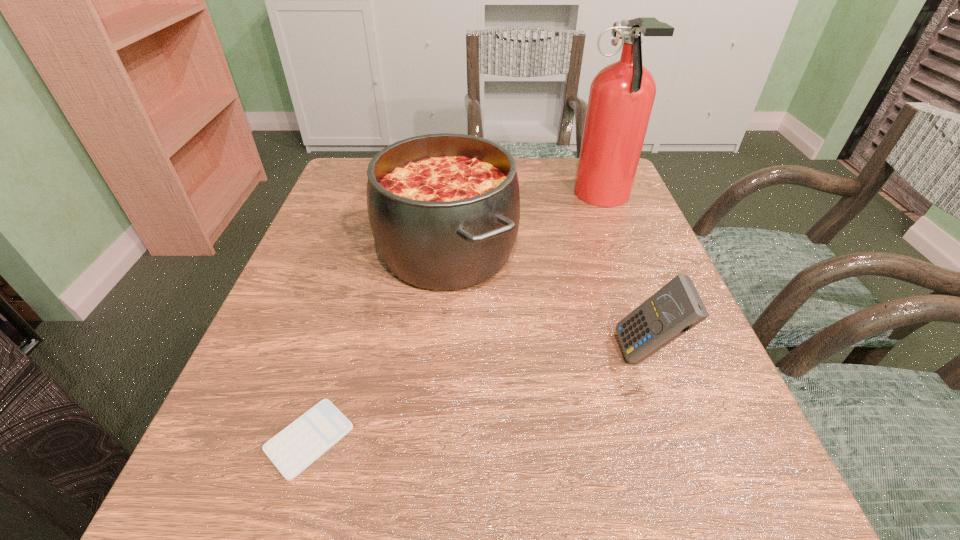
Identify which object is the second closest to the tallest object. Please provide its 2D coordinates. Your answer should be formatted as a tuple, i.e. [(x, y)], where the tuple contains the x and y coordinates of a point satisfying the conditions above.

[(676, 308)]

Locate an element on the screen. The width and height of the screenshot is (960, 540). vacant space that satisfies the following two spatial constraints: 1. on the back side of the tallest object; 2. on the left side of the left calculator is located at coordinates (383, 198).

This screenshot has width=960, height=540. I want to click on free region that satisfies the following two spatial constraints: 1. on the back side of the fire extinguisher; 2. on the right side of the casserole, so click(452, 198).

At what (x,y) coordinates should I click in order to perform the action: click on free point that satisfies the following two spatial constraints: 1. on the back side of the nearer calculator; 2. on the left side of the fire extinguisher. Please return your answer as a coordinate pair (x, y). Looking at the image, I should click on (383, 198).

Where is `vacant position in the image that satisfies the following two spatial constraints: 1. on the back side of the casserole; 2. on the left side of the nearer calculator`? The height and width of the screenshot is (540, 960). vacant position in the image that satisfies the following two spatial constraints: 1. on the back side of the casserole; 2. on the left side of the nearer calculator is located at coordinates 367,251.

The image size is (960, 540). In order to click on free space in the image that satisfies the following two spatial constraints: 1. on the back side of the tallest object; 2. on the right side of the nearest object in this screenshot , I will do `click(383, 198)`.